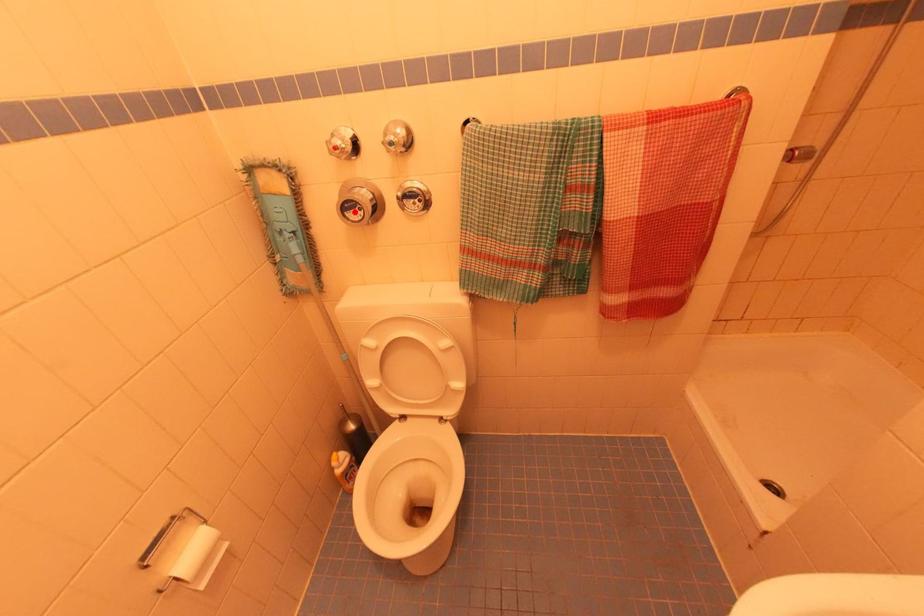
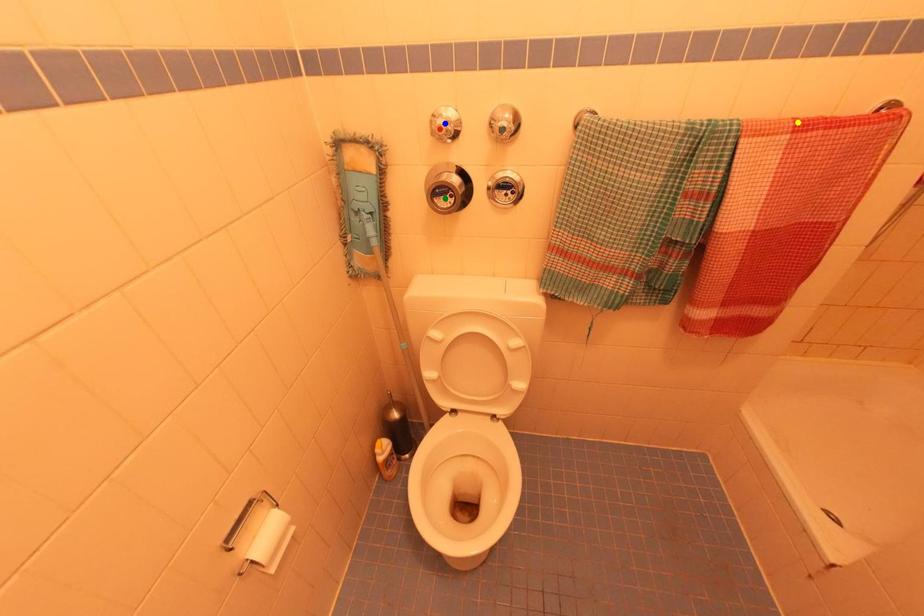
Question: I am providing you with two images of the same scene from different viewpoints. A red point is marked on the first image. You are given multiple points on the second image. In image 2, which mark is for the same physical point as the one in image 1?

Choices:
 (A) blue point
 (B) yellow point
 (C) green point

Answer: (C)